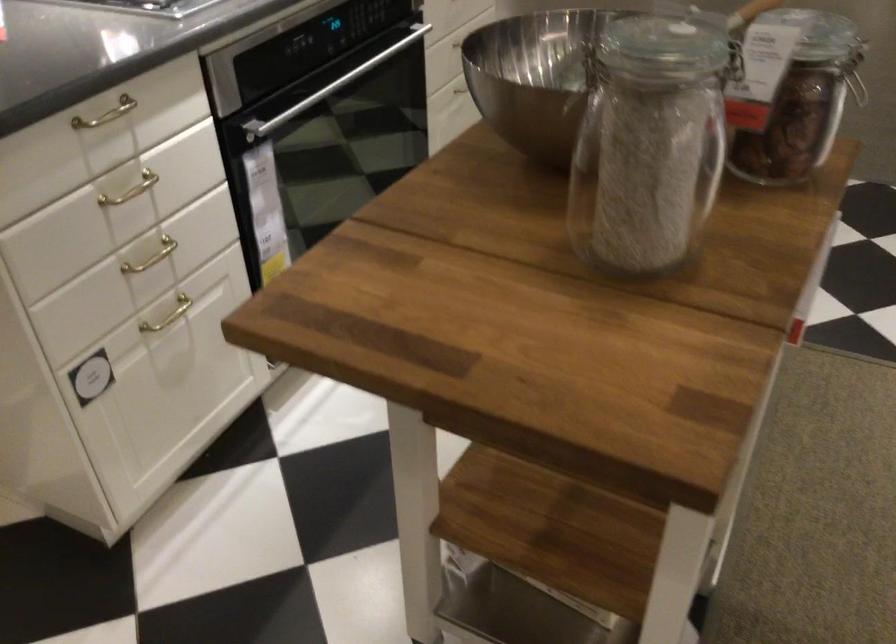
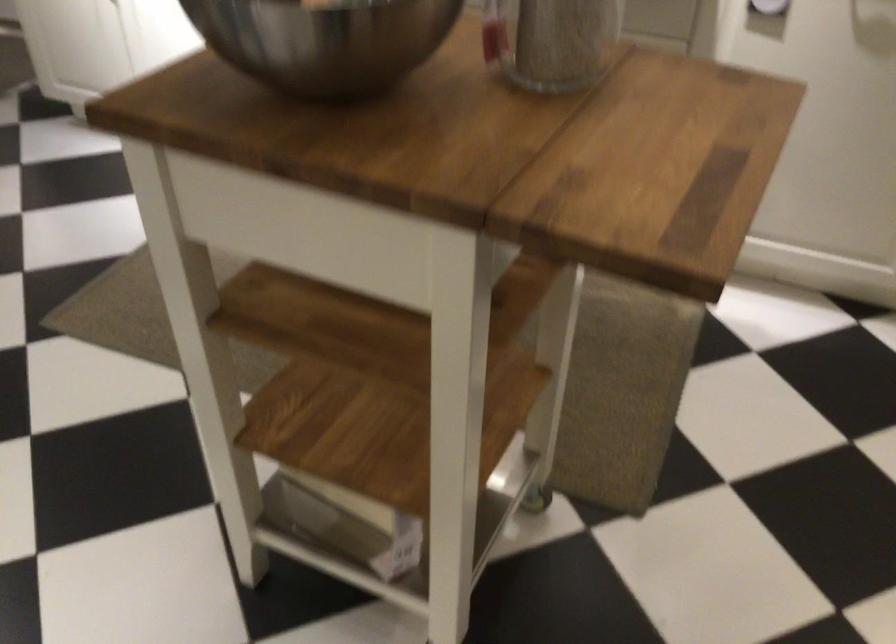
Where in the second image is the point corresponding to the point at 604,205 from the first image?

(553, 41)